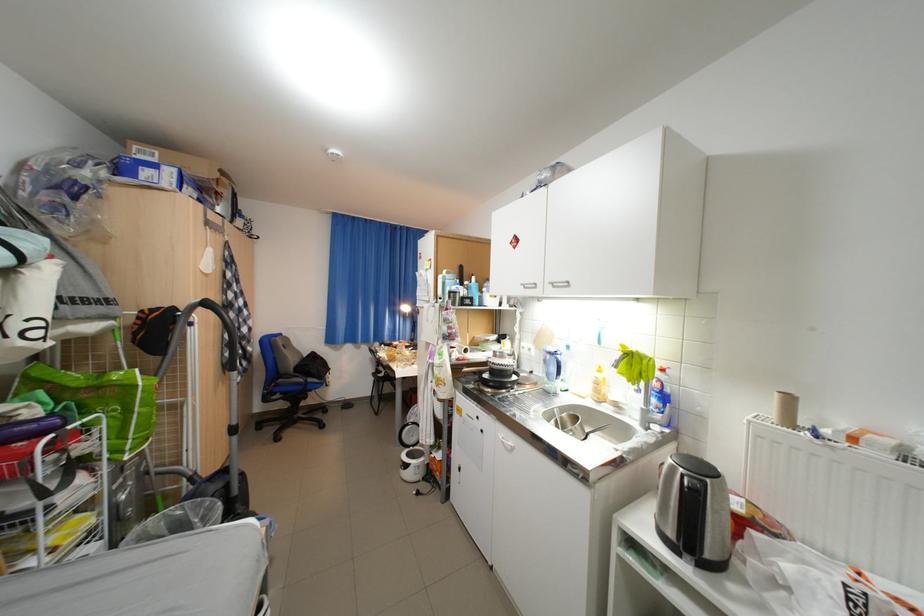
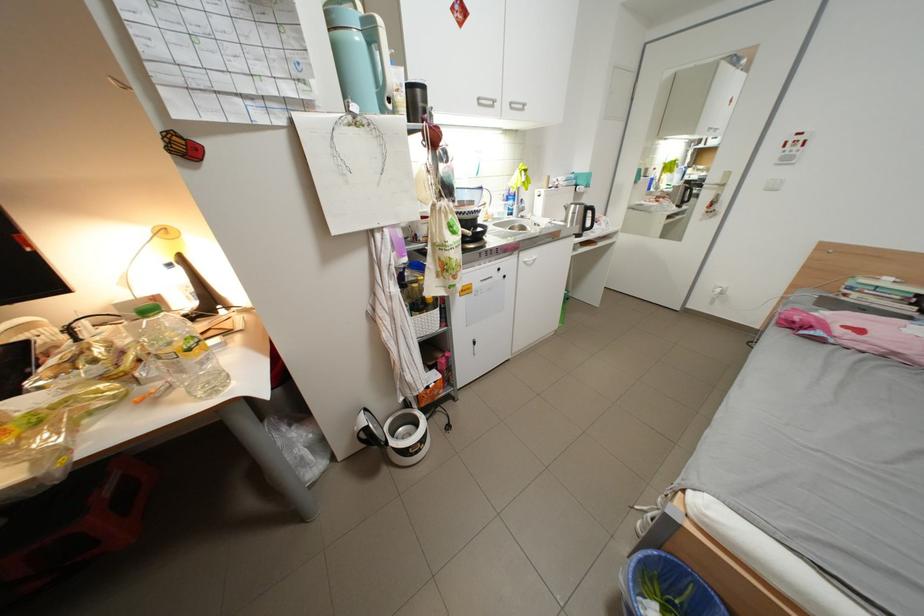
Where in the second image is the point corresponding to point 564,285 from the first image?

(523, 105)